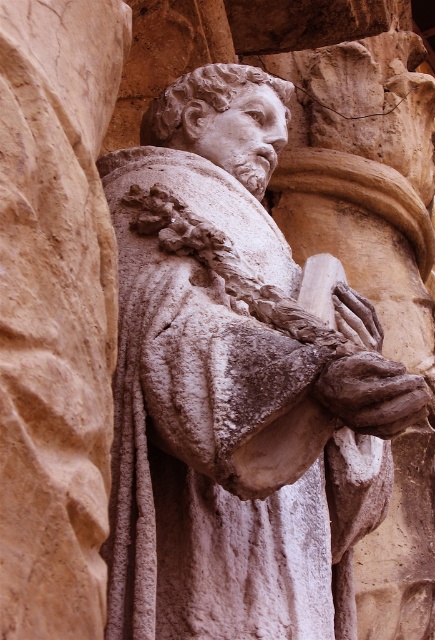
Consider the image. Does white stone head at center come behind smooth stone hand at center?

That is True.

Between white stone head at center and smooth stone hand at center, which one is positioned lower?

smooth stone hand at center is lower down.

Is point (230, 100) farther from camera compared to point (340, 324)?

Yes, point (230, 100) is farther from viewer.

The height and width of the screenshot is (640, 435). I want to click on white stone head at center, so click(x=224, y=120).

Based on the photo, is brown stone hand at center positioned at the back of smooth stone hand at center?

No, brown stone hand at center is closer to the viewer.

Does brown stone hand at center have a greater width compared to smooth stone hand at center?

Yes.

Locate an element on the screen. brown stone hand at center is located at coordinates (372, 394).

Is white stone statue at center thinner than brown stone hand at center?

No.

Where is `white stone statue at center`? Image resolution: width=435 pixels, height=640 pixels. white stone statue at center is located at coordinates (231, 387).